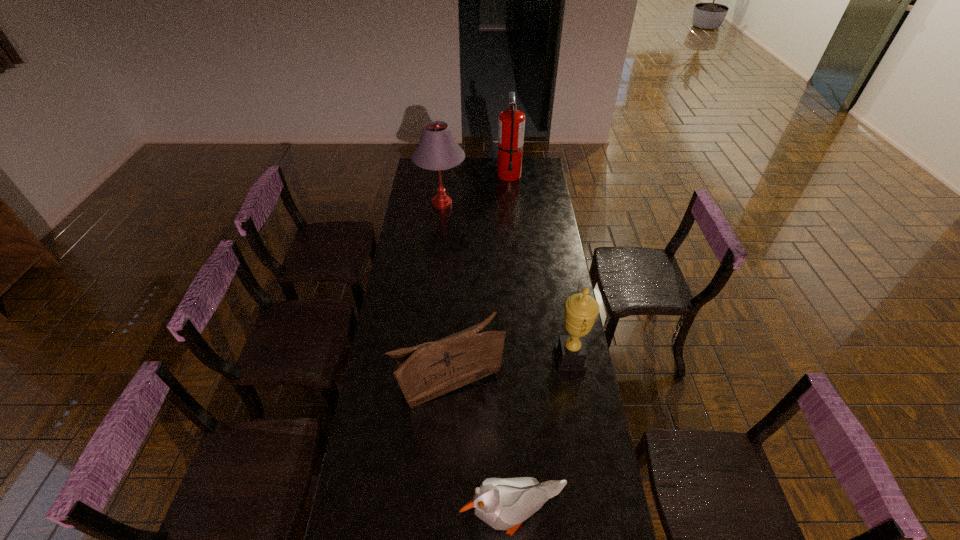
This screenshot has height=540, width=960. Identify the location of vacant space that is in between the grocery bag and the fourth nearest object. (444, 295).

This screenshot has height=540, width=960. I want to click on free space that is in between the grocery bag and the table lamp, so click(x=444, y=295).

You are a GUI agent. You are given a task and a screenshot of the screen. Output one action in this format:
    pyautogui.click(x=<x>, y=<y>)
    Task: Click on the free spot between the fire extinguisher and the rightmost object
    The width and height of the screenshot is (960, 540).
    Given the screenshot: What is the action you would take?
    pyautogui.click(x=540, y=266)

What are the coordinates of `free point between the fire extinguisher and the table lamp` in the screenshot? It's located at (475, 190).

The width and height of the screenshot is (960, 540). Find the location of `the third closest object to the second farthest object`. the third closest object to the second farthest object is located at coordinates (581, 310).

Identify the location of the second closest object relative to the table lamp. The image size is (960, 540). pos(426,371).

Image resolution: width=960 pixels, height=540 pixels. Find the location of `vacant point that satisfies the following two spatial constraints: 1. on the front-facing side of the grocery bag; 2. on the right side of the second farthest object`. vacant point that satisfies the following two spatial constraints: 1. on the front-facing side of the grocery bag; 2. on the right side of the second farthest object is located at coordinates (423, 386).